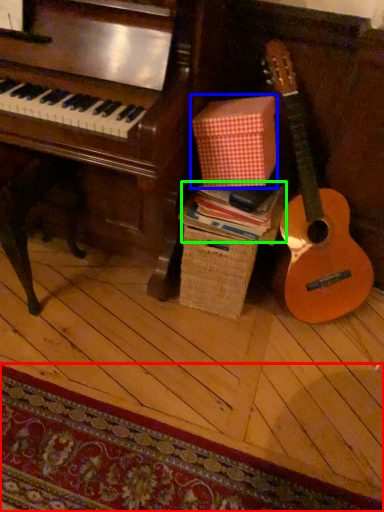
Question: Which object is positioned farthest from mat (highlighted by a red box)? Select from cardboard box (highlighted by a blue box) and book (highlighted by a green box).

Choices:
 (A) cardboard box
 (B) book

Answer: (A)